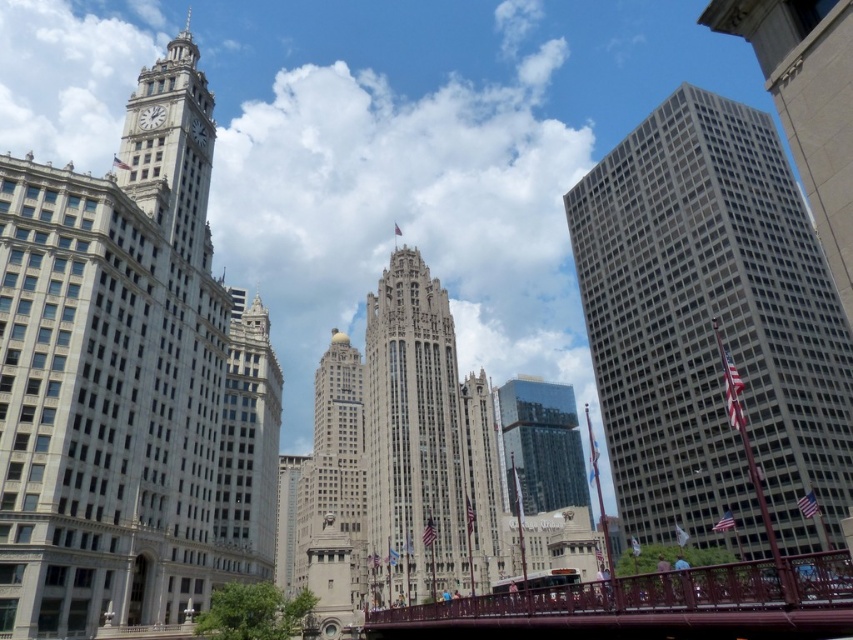
Question: Can you confirm if white stone clock tower at upper left is positioned above glassy reflective skyscraper at center?

Choices:
 (A) yes
 (B) no

Answer: (A)

Question: Based on their relative distances, which object is nearer to the glassy reflective skyscraper at center?

Choices:
 (A) gray concrete skyscraper at right
 (B) gold dome building at center
 (C) white marble clock at upper left

Answer: (B)

Question: Which of the following is the closest to the observer?

Choices:
 (A) white marble clock at upper left
 (B) white stone clock tower at upper left

Answer: (B)

Question: Is white stone clock tower at upper left positioned at the back of glassy reflective skyscraper at center?

Choices:
 (A) yes
 (B) no

Answer: (B)

Question: Which object is closer to the camera taking this photo?

Choices:
 (A) white marble clock at upper left
 (B) light gray stone skyscraper at center
 (C) white stone clock tower at left
 (D) glassy reflective skyscraper at center

Answer: (C)

Question: Is gold dome building at center smaller than glassy reflective skyscraper at center?

Choices:
 (A) yes
 (B) no

Answer: (B)